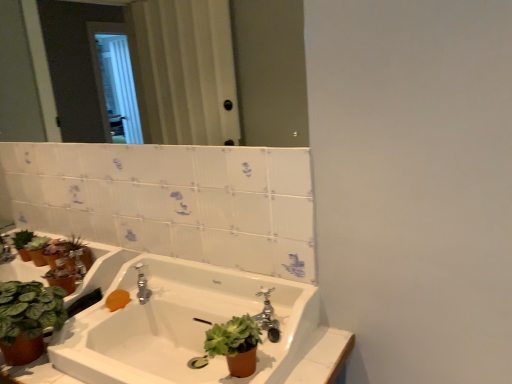
Question: Is orange matte soap at lower left oriented away from green matte succulent at lower center?

Choices:
 (A) no
 (B) yes

Answer: (A)

Question: Are orange matte soap at lower left and green matte succulent at lower center making contact?

Choices:
 (A) no
 (B) yes

Answer: (A)

Question: From the image's perspective, is orange matte soap at lower left on top of green matte succulent at lower center?

Choices:
 (A) yes
 (B) no

Answer: (A)

Question: Is orange matte soap at lower left aimed at green matte succulent at lower center?

Choices:
 (A) no
 (B) yes

Answer: (A)

Question: Can you confirm if orange matte soap at lower left is shorter than green matte succulent at lower center?

Choices:
 (A) yes
 (B) no

Answer: (A)

Question: Is orange matte soap at lower left at the right side of green matte succulent at lower center?

Choices:
 (A) no
 (B) yes

Answer: (A)

Question: Is clear glass mirror at upper center bigger than white glossy sink at center?

Choices:
 (A) yes
 (B) no

Answer: (B)

Question: Can white glossy sink at center be found inside clear glass mirror at upper center?

Choices:
 (A) no
 (B) yes

Answer: (A)

Question: From a real-world perspective, is clear glass mirror at upper center physically below white glossy sink at center?

Choices:
 (A) yes
 (B) no

Answer: (B)

Question: From a real-world perspective, is clear glass mirror at upper center on top of white glossy sink at center?

Choices:
 (A) no
 (B) yes

Answer: (B)

Question: From the image's perspective, is clear glass mirror at upper center on white glossy sink at center?

Choices:
 (A) no
 (B) yes

Answer: (B)

Question: Is clear glass mirror at upper center smaller than white glossy sink at center?

Choices:
 (A) no
 (B) yes

Answer: (B)

Question: Is orange matte soap at lower left outside of clear glass mirror at upper center?

Choices:
 (A) yes
 (B) no

Answer: (A)